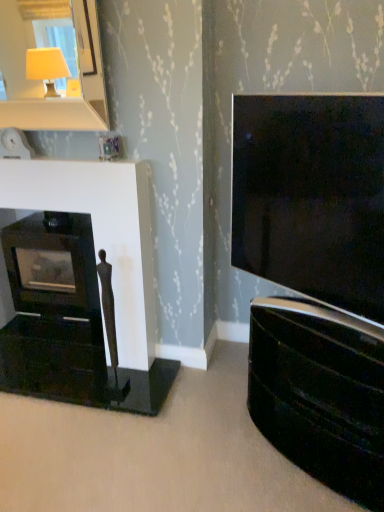
I want to click on unoccupied area in front of matte black fireplace at left, so click(60, 376).